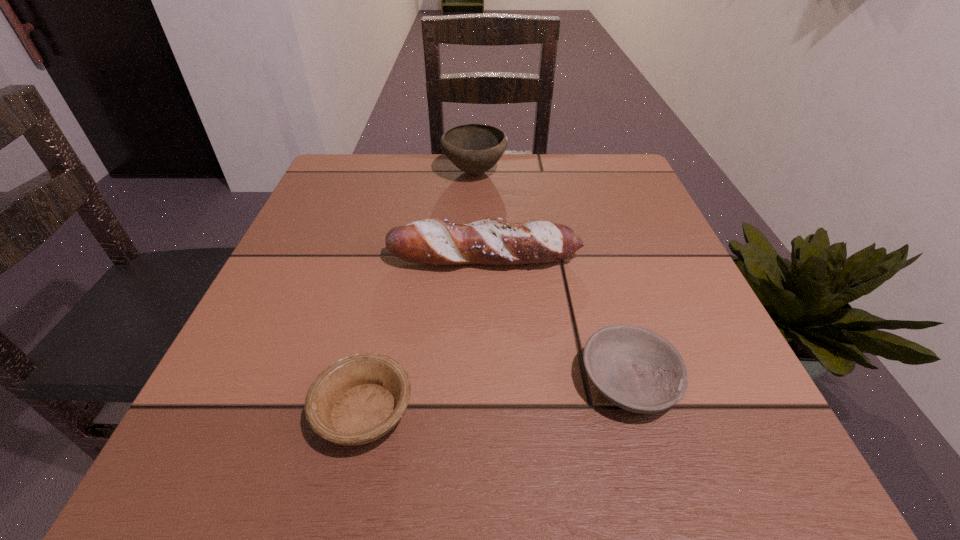
Identify the location of object at the left edge. tap(358, 399).

Find the location of a particular element. object that is at the right edge is located at coordinates (636, 369).

The image size is (960, 540). I want to click on object that is at the near left corner, so click(x=358, y=399).

The image size is (960, 540). In the image, there is a desktop. What are the coordinates of `free region at the far edge` in the screenshot? It's located at (442, 154).

In the image, there is a desktop. Identify the location of vacant space at the near edge. The height and width of the screenshot is (540, 960). (636, 467).

In the image, there is a desktop. At what (x,y) coordinates should I click in order to perform the action: click on free space at the left edge. Please return your answer as a coordinate pair (x, y). The image size is (960, 540). Looking at the image, I should click on (332, 219).

Find the location of a particular element. blank space at the right edge is located at coordinates (693, 284).

Locate an element on the screen. The width and height of the screenshot is (960, 540). free location at the far left corner of the desktop is located at coordinates (313, 199).

Image resolution: width=960 pixels, height=540 pixels. In the image, there is a desktop. Identify the location of vacant space at the near left corner. click(x=252, y=483).

Identify the location of vacant region at the far right corner of the desktop. (586, 179).